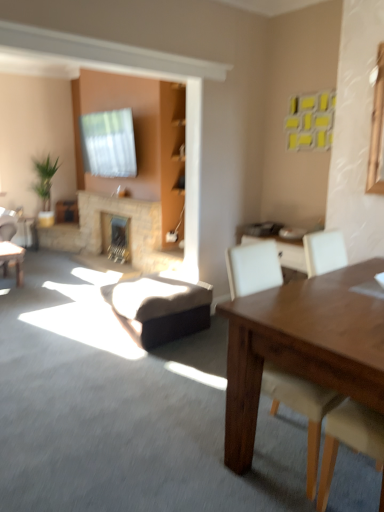
Question: Is natural stone fireplace at center, which ranks as the second fireplace in back-to-front order, positioned far away from white leather chair at right?

Choices:
 (A) no
 (B) yes

Answer: (B)

Question: Considering the relative sizes of natural stone fireplace at center, which ranks as the second fireplace in back-to-front order, and white leather chair at right in the image provided, is natural stone fireplace at center, which ranks as the second fireplace in back-to-front order, bigger than white leather chair at right?

Choices:
 (A) no
 (B) yes

Answer: (A)

Question: Is natural stone fireplace at center, which ranks as the second fireplace in back-to-front order, positioned with its back to white leather chair at right?

Choices:
 (A) yes
 (B) no

Answer: (B)

Question: Does natural stone fireplace at center, which ranks as the second fireplace in back-to-front order, have a greater height compared to white leather chair at right?

Choices:
 (A) yes
 (B) no

Answer: (B)

Question: From a real-world perspective, is natural stone fireplace at center, positioned as the 1th fireplace in front-to-back order, positioned under white leather chair at right based on gravity?

Choices:
 (A) yes
 (B) no

Answer: (A)

Question: Can you confirm if natural stone fireplace at center, which ranks as the second fireplace in back-to-front order, is positioned to the right of white leather chair at right?

Choices:
 (A) yes
 (B) no

Answer: (B)

Question: Could you tell me if brown leather swivel chair at center is facing green leafy plant at left?

Choices:
 (A) yes
 (B) no

Answer: (B)

Question: Considering the relative sizes of brown leather swivel chair at center and green leafy plant at left in the image provided, is brown leather swivel chair at center bigger than green leafy plant at left?

Choices:
 (A) yes
 (B) no

Answer: (B)

Question: Considering the relative positions of brown leather swivel chair at center and green leafy plant at left in the image provided, is brown leather swivel chair at center to the left of green leafy plant at left from the viewer's perspective?

Choices:
 (A) yes
 (B) no

Answer: (B)

Question: Is brown leather swivel chair at center wider than green leafy plant at left?

Choices:
 (A) no
 (B) yes

Answer: (B)

Question: Is green leafy plant at left at the back of brown leather swivel chair at center?

Choices:
 (A) yes
 (B) no

Answer: (B)

Question: Is brown leather swivel chair at center positioned behind green leafy plant at left?

Choices:
 (A) yes
 (B) no

Answer: (B)

Question: Considering the relative positions of natural stone fireplace at center, positioned as the 1th fireplace in front-to-back order, and green leafy plant at left in the image provided, is natural stone fireplace at center, positioned as the 1th fireplace in front-to-back order, to the left of green leafy plant at left from the viewer's perspective?

Choices:
 (A) no
 (B) yes

Answer: (A)